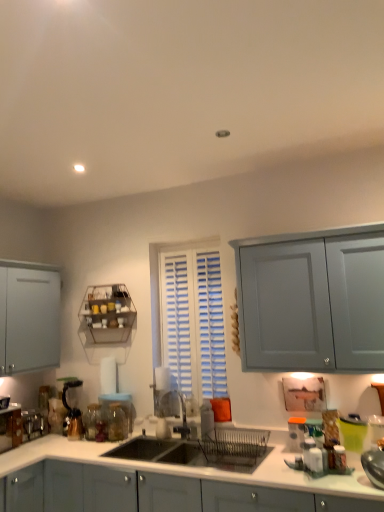
What are the coordinates of `unoccupied region to the right of transparent glass jar at sink, the 1th glass jar viewed from the right` in the screenshot? It's located at (132, 442).